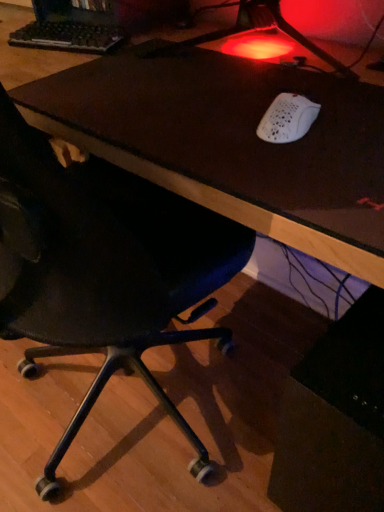
The width and height of the screenshot is (384, 512). I want to click on black plastic keyboard at upper left, so click(68, 28).

Image resolution: width=384 pixels, height=512 pixels. What do you see at coordinates (233, 144) in the screenshot?
I see `brown leather desk at center` at bounding box center [233, 144].

What is the approximate height of white matte mouse at upper right?

white matte mouse at upper right is 1.97 inches in height.

The height and width of the screenshot is (512, 384). Identify the location of black plastic keyboard at upper left. (68, 28).

How different are the orientations of white matte mouse at upper right and black plastic keyboard at upper left in degrees?

They differ by 10.8 degrees in their facing directions.

Looking at this image, which of these two, white matte mouse at upper right or black plastic keyboard at upper left, stands taller?

With more height is white matte mouse at upper right.

Is white matte mouse at upper right to the left of black plastic keyboard at upper left from the viewer's perspective?

No.

From a real-world perspective, who is located lower, white matte mouse at upper right or black plastic keyboard at upper left?

In real-world perspective, black plastic keyboard at upper left is lower.

Is there a large distance between brown leather desk at center and black plastic keyboard at upper left?

brown leather desk at center is near black plastic keyboard at upper left, not far away.

Considering the sizes of objects brown leather desk at center and black plastic keyboard at upper left in the image provided, who is smaller, brown leather desk at center or black plastic keyboard at upper left?

With smaller size is black plastic keyboard at upper left.

Identify the location of table located underneath the black plastic keyboard at upper left (from a real-world perspective). (233, 144).

What's the angular difference between black mesh chair at lower left and brown leather desk at center's facing directions?

0.333 degrees separate the facing orientations of black mesh chair at lower left and brown leather desk at center.

Does black mesh chair at lower left have a smaller size compared to brown leather desk at center?

No.

Looking at their sizes, would you say black mesh chair at lower left is wider or thinner than brown leather desk at center?

black mesh chair at lower left is wider than brown leather desk at center.

Identify the location of table located in front of the black mesh chair at lower left. The image size is (384, 512). (233, 144).

Considering the positions of points (188, 268) and (56, 48), is point (188, 268) farther from camera compared to point (56, 48)?

No, (188, 268) is in front of (56, 48).

From the image's perspective, between black mesh chair at lower left and black plastic keyboard at upper left, who is located below?

black mesh chair at lower left, from the image's perspective.

Is black mesh chair at lower left in contact with black plastic keyboard at upper left?

black mesh chair at lower left and black plastic keyboard at upper left are not in contact.

Which object is positioned more to the left, black mesh chair at lower left or black plastic keyboard at upper left?

Positioned to the left is black plastic keyboard at upper left.

Which of these two, brown leather desk at center or white matte mouse at upper right, stands shorter?

With less height is white matte mouse at upper right.

Considering the points (185, 167) and (287, 129), which point is in front, point (185, 167) or point (287, 129)?

The point (185, 167) is closer.

How far apart are brown leather desk at center and white matte mouse at upper right?

brown leather desk at center is 6.12 inches from white matte mouse at upper right.

Locate an element on the screen. table on the left of white matte mouse at upper right is located at coordinates (233, 144).

Considering the positions of objects black plastic keyboard at upper left and brown leather desk at center in the image provided, who is behind, black plastic keyboard at upper left or brown leather desk at center?

black plastic keyboard at upper left is behind.

How distant is black plastic keyboard at upper left from brown leather desk at center?

black plastic keyboard at upper left and brown leather desk at center are 16.66 inches apart.

Looking at this image, can we say black plastic keyboard at upper left lies outside brown leather desk at center?

That's correct, black plastic keyboard at upper left is outside of brown leather desk at center.

Looking at this image, between black plastic keyboard at upper left and brown leather desk at center, which one appears on the right side from the viewer's perspective?

brown leather desk at center is more to the right.

Would you consider black mesh chair at lower left to be distant from white matte mouse at upper right?

Actually, black mesh chair at lower left and white matte mouse at upper right are a little close together.

In the image, is black mesh chair at lower left on the left side or the right side of white matte mouse at upper right?

black mesh chair at lower left is positioned on white matte mouse at upper right's left side.

From the image's perspective, is black mesh chair at lower left above white matte mouse at upper right?

No.

This screenshot has width=384, height=512. In order to click on chair located below the white matte mouse at upper right (from the image's perspective) in this screenshot , I will do `click(103, 268)`.

What are the coordinates of `mouse in front of the black plastic keyboard at upper left` in the screenshot? It's located at (287, 119).

Where is `desktop computer positioned vertically above the brown leather desk at center (from a real-world perspective)`? The width and height of the screenshot is (384, 512). desktop computer positioned vertically above the brown leather desk at center (from a real-world perspective) is located at coordinates (68, 28).

In the scene shown: Estimate the real-world distances between objects in this image. Which object is further from black plastic keyboard at upper left, white matte mouse at upper right or brown leather desk at center?

white matte mouse at upper right is further to black plastic keyboard at upper left.

Which object lies nearer to the anchor point black plastic keyboard at upper left, black mesh chair at lower left or brown leather desk at center?

brown leather desk at center is positioned closer to the anchor black plastic keyboard at upper left.

Based on their spatial positions, is black mesh chair at lower left or white matte mouse at upper right closer to brown leather desk at center?

Based on the image, white matte mouse at upper right appears to be nearer to brown leather desk at center.

When comparing their distances from brown leather desk at center, does black plastic keyboard at upper left or black mesh chair at lower left seem closer?

The object closer to brown leather desk at center is black mesh chair at lower left.

Looking at this image, considering their positions, is black mesh chair at lower left positioned closer to black plastic keyboard at upper left than white matte mouse at upper right?

Based on the image, black mesh chair at lower left appears to be nearer to black plastic keyboard at upper left.

When comparing their distances from black mesh chair at lower left, does black plastic keyboard at upper left or brown leather desk at center seem closer?

brown leather desk at center lies closer to black mesh chair at lower left than the other object.

Which object lies nearer to the anchor point black mesh chair at lower left, brown leather desk at center or white matte mouse at upper right?

brown leather desk at center is positioned closer to the anchor black mesh chair at lower left.

When comparing their distances from white matte mouse at upper right, does brown leather desk at center or black plastic keyboard at upper left seem closer?

The object closer to white matte mouse at upper right is brown leather desk at center.

I want to click on mouse between brown leather desk at center and black plastic keyboard at upper left along the z-axis, so click(x=287, y=119).

The image size is (384, 512). I want to click on table between black plastic keyboard at upper left and black mesh chair at lower left from top to bottom, so click(233, 144).

The image size is (384, 512). I want to click on mouse between brown leather desk at center and black mesh chair at lower left in the vertical direction, so click(x=287, y=119).

At what (x,y) coordinates should I click in order to perform the action: click on mouse between black plastic keyboard at upper left and black mesh chair at lower left from top to bottom. Please return your answer as a coordinate pair (x, y). Image resolution: width=384 pixels, height=512 pixels. Looking at the image, I should click on (287, 119).